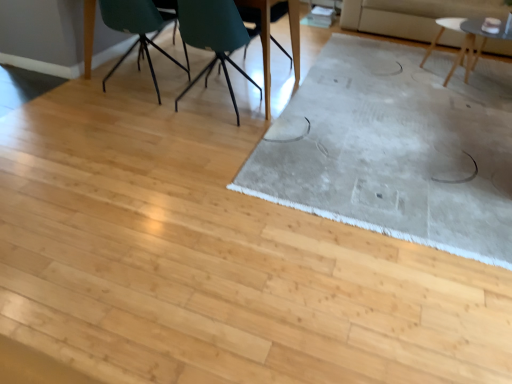
I want to click on free space to the left of white glossy table at upper right, which is the 2th table in left-to-right order, so click(389, 74).